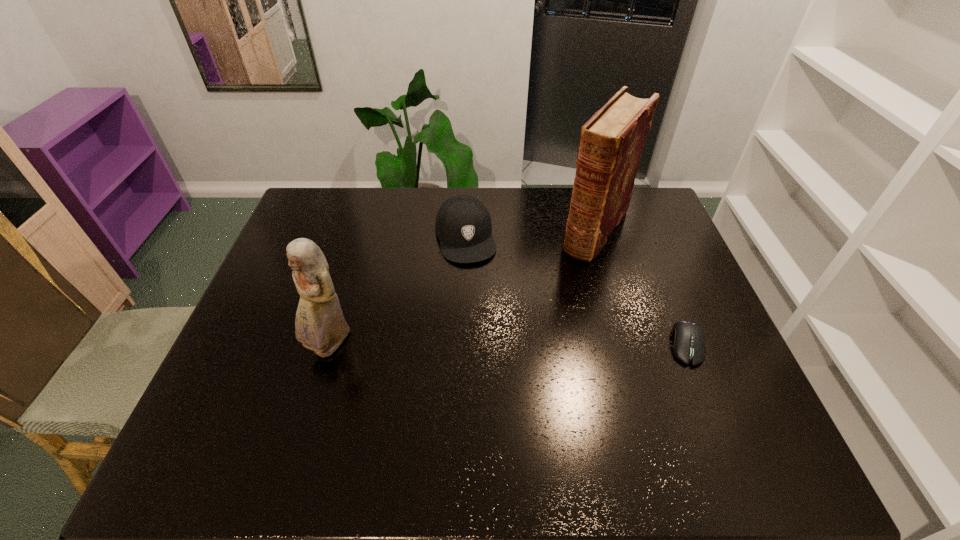
At what (x,y) coordinates should I click in order to perform the action: click on vacant space located 0.300m on the spine side of the hardback book. Please return your answer as a coordinate pair (x, y). Image resolution: width=960 pixels, height=540 pixels. Looking at the image, I should click on (537, 319).

Where is `vacant space located 0.380m on the front-facing side of the second shortest object`? vacant space located 0.380m on the front-facing side of the second shortest object is located at coordinates (495, 371).

This screenshot has width=960, height=540. In order to click on free space located on the front-facing side of the second shortest object in this screenshot , I will do `click(472, 277)`.

Where is `free space located 0.110m on the front-facing side of the second shortest object`? free space located 0.110m on the front-facing side of the second shortest object is located at coordinates (476, 292).

Locate an element on the screen. The height and width of the screenshot is (540, 960). hardback book located at the far edge is located at coordinates (611, 143).

The image size is (960, 540). In order to click on cap located in the far edge section of the desktop in this screenshot , I will do `click(463, 225)`.

Locate an element on the screen. The height and width of the screenshot is (540, 960). computer equipment at the right edge is located at coordinates (688, 338).

The height and width of the screenshot is (540, 960). Find the location of `hardback book situated at the right edge`. hardback book situated at the right edge is located at coordinates (611, 143).

Find the location of a particular element. This screenshot has width=960, height=540. object that is at the far right corner is located at coordinates (611, 143).

The image size is (960, 540). Identify the location of vacant space at the far edge of the desktop. (356, 220).